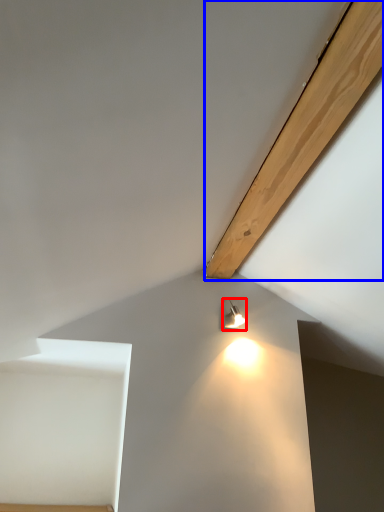
Question: Which of the following is the closest to the observer, lamp (highlighted by a red box) or plywood (highlighted by a blue box)?

Choices:
 (A) lamp
 (B) plywood

Answer: (B)